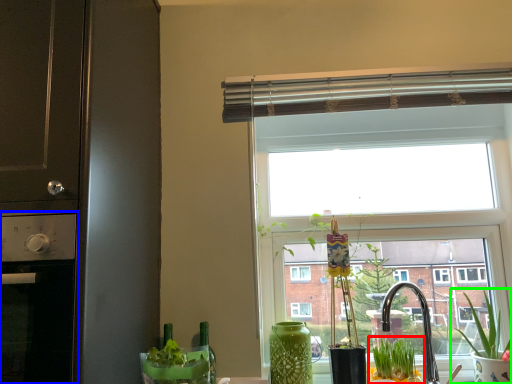
Question: Estimate the real-world distances between objects in this image. Which object is closer to houseplant (highlighted by a red box), appliance (highlighted by a blue box) or houseplant (highlighted by a green box)?

Choices:
 (A) appliance
 (B) houseplant

Answer: (B)